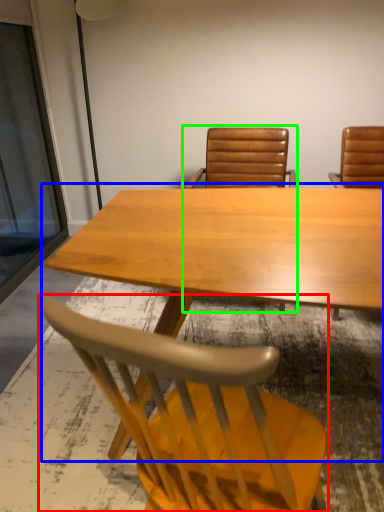
Question: Based on their relative distances, which object is farther from chair (highlighted by a red box)? Choose from table (highlighted by a blue box) and chair (highlighted by a green box).

Choices:
 (A) table
 (B) chair

Answer: (B)